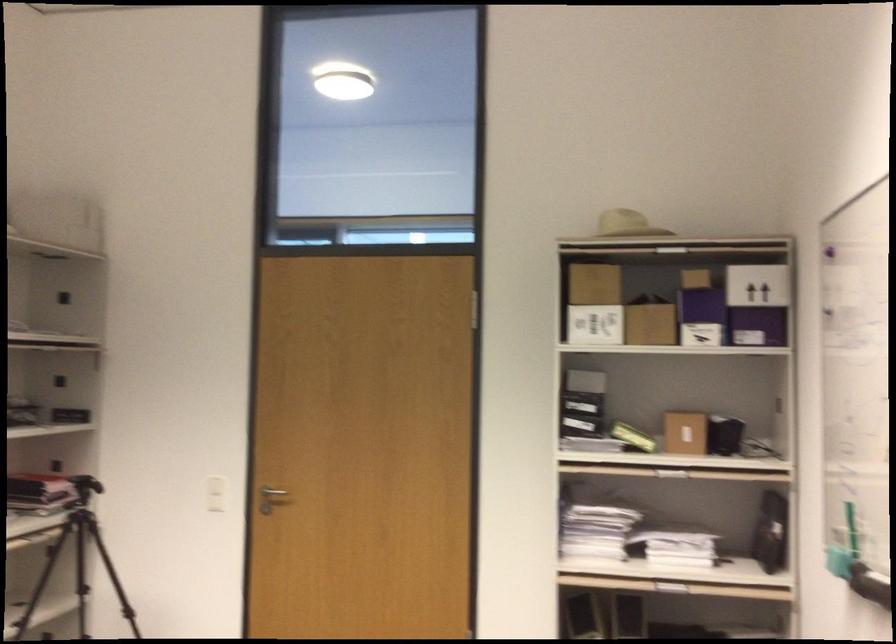
Locate an element on the screen. silver door handle is located at coordinates [272, 491].